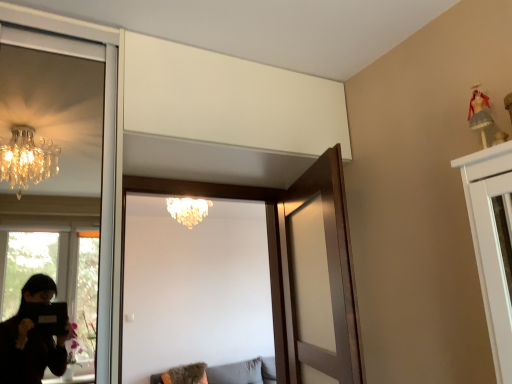
Question: From the image's perspective, does wooden door at center, acting as the 1th door starting from the right, appear lower than wooden door at center, placed as the 1th door when sorted from left to right?

Choices:
 (A) no
 (B) yes

Answer: (A)

Question: Can you confirm if wooden door at center, which ranks as the 2th door in left-to-right order, is smaller than wooden door at center, acting as the 2th door starting from the right?

Choices:
 (A) no
 (B) yes

Answer: (B)

Question: Does wooden door at center, which ranks as the 2th door in left-to-right order, have a greater width compared to wooden door at center, placed as the 1th door when sorted from left to right?

Choices:
 (A) yes
 (B) no

Answer: (B)

Question: From the image's perspective, would you say wooden door at center, acting as the 1th door starting from the right, is positioned over wooden door at center, acting as the 2th door starting from the right?

Choices:
 (A) yes
 (B) no

Answer: (A)

Question: From a real-world perspective, is wooden door at center, which ranks as the 2th door in left-to-right order, located higher than wooden door at center, placed as the 1th door when sorted from left to right?

Choices:
 (A) no
 (B) yes

Answer: (A)

Question: Is point (298, 309) closer or farther from the camera than point (201, 205)?

Choices:
 (A) farther
 (B) closer

Answer: (B)

Question: In terms of width, does wooden door at center, acting as the 1th door starting from the right, look wider or thinner when compared to crystal chandelier at upper center?

Choices:
 (A) thin
 (B) wide

Answer: (A)

Question: Is wooden door at center, which ranks as the 2th door in left-to-right order, inside the boundaries of crystal chandelier at upper center, or outside?

Choices:
 (A) inside
 (B) outside

Answer: (B)

Question: Visually, is wooden door at center, acting as the 1th door starting from the right, positioned to the left or to the right of crystal chandelier at upper center?

Choices:
 (A) right
 (B) left

Answer: (A)

Question: In terms of size, does crystal chandelier at upper center appear bigger or smaller than wooden door at center, acting as the 1th door starting from the right?

Choices:
 (A) big
 (B) small

Answer: (A)

Question: Considering their positions, is crystal chandelier at upper center located in front of or behind wooden door at center, acting as the 1th door starting from the right?

Choices:
 (A) behind
 (B) front

Answer: (A)

Question: From the image's perspective, relative to wooden door at center, acting as the 1th door starting from the right, is crystal chandelier at upper center above or below?

Choices:
 (A) below
 (B) above

Answer: (B)

Question: Would you say crystal chandelier at upper center is to the left or to the right of wooden door at center, which ranks as the 2th door in left-to-right order, in the picture?

Choices:
 (A) left
 (B) right

Answer: (A)

Question: Considering their positions, is wooden door at center, which ranks as the 2th door in left-to-right order, located in front of or behind gray fabric couch at lower center?

Choices:
 (A) behind
 (B) front

Answer: (B)

Question: Is wooden door at center, acting as the 1th door starting from the right, spatially inside gray fabric couch at lower center, or outside of it?

Choices:
 (A) inside
 (B) outside

Answer: (B)